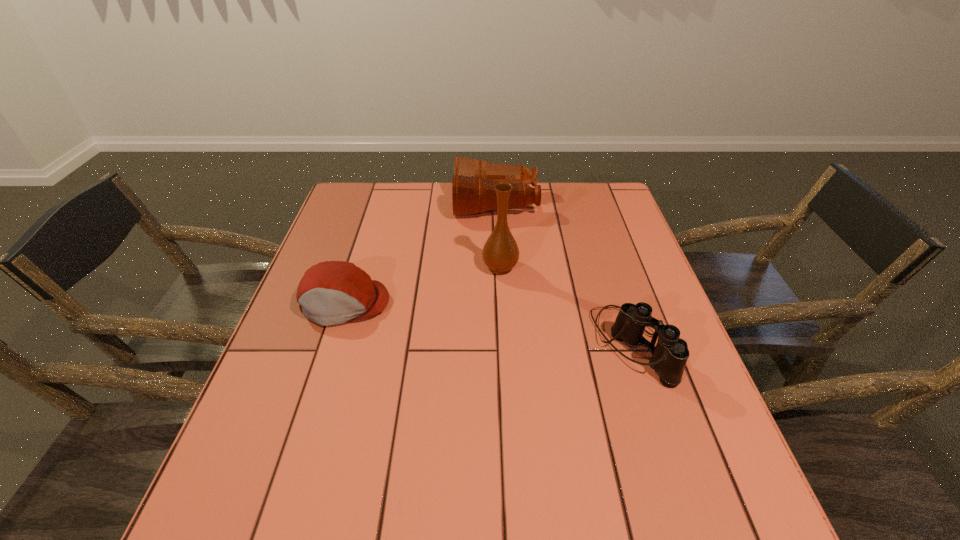
Where is `free point at the right edge`? Image resolution: width=960 pixels, height=540 pixels. free point at the right edge is located at coordinates (615, 282).

Where is `vacant space at the far left corner`? This screenshot has height=540, width=960. vacant space at the far left corner is located at coordinates (348, 188).

Find the location of a particular element. The width and height of the screenshot is (960, 540). vacant region at the near left corner of the desktop is located at coordinates (272, 501).

Locate an element on the screen. vacant space at the far right corner of the desktop is located at coordinates (598, 188).

At what (x,y) coordinates should I click in order to perform the action: click on vacant space that's between the right binoculars and the leftmost object. Please return your answer as a coordinate pair (x, y). The height and width of the screenshot is (540, 960). Looking at the image, I should click on (489, 325).

Identify the location of free space between the tallest object and the cap. (422, 285).

Where is `vacant space in between the rightmost object and the vase`? This screenshot has height=540, width=960. vacant space in between the rightmost object and the vase is located at coordinates (565, 306).

I want to click on unoccupied area between the left binoculars and the shortest object, so click(420, 253).

Where is `vacant area between the cap and the nearer binoculars`? The height and width of the screenshot is (540, 960). vacant area between the cap and the nearer binoculars is located at coordinates (489, 325).

Find the location of `unoccupied position between the shortest object and the farther binoculars`. unoccupied position between the shortest object and the farther binoculars is located at coordinates (420, 253).